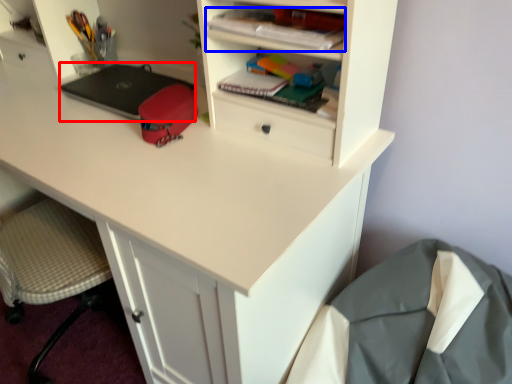
Question: Which object appears farthest to the camera in this image, laptop (highlighted by a red box) or book (highlighted by a blue box)?

Choices:
 (A) laptop
 (B) book

Answer: (A)